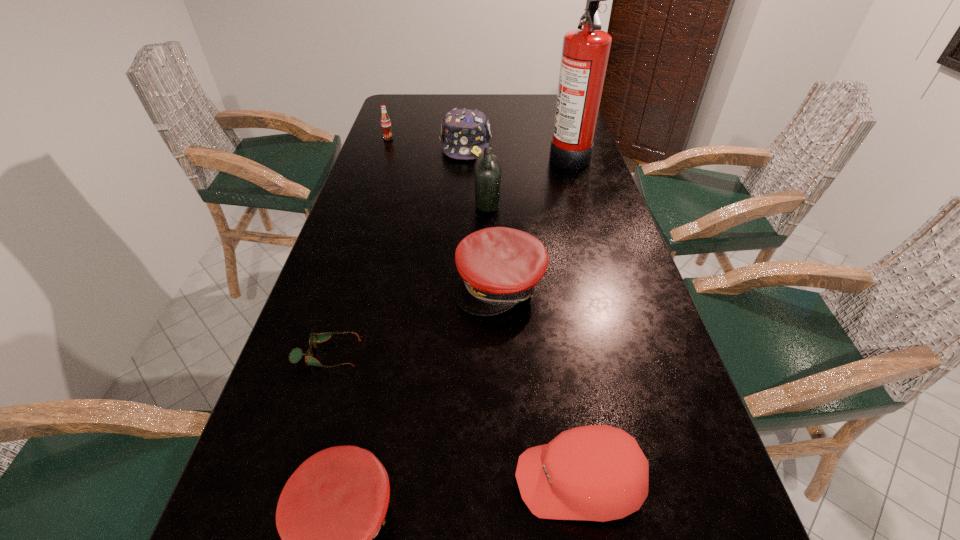
This screenshot has height=540, width=960. I want to click on the tallest object, so click(585, 52).

The width and height of the screenshot is (960, 540). Find the location of `the seventh shortest object`. the seventh shortest object is located at coordinates (487, 170).

Locate an element on the screen. The height and width of the screenshot is (540, 960). the fourth farthest object is located at coordinates (487, 170).

I want to click on soda, so click(x=385, y=121).

You are a GUI agent. You are given a task and a screenshot of the screen. Output one action in this format:
    pyautogui.click(x=<x>, y=<y>)
    Task: Click on the farthest cap
    This screenshot has height=540, width=960.
    Given the screenshot: What is the action you would take?
    pyautogui.click(x=465, y=133)

You are a GUI agent. You are given a task and a screenshot of the screen. Output one action in this format:
    pyautogui.click(x=<x>, y=<y>)
    Task: Click on the fourth nearest object
    
    Given the screenshot: What is the action you would take?
    pyautogui.click(x=499, y=267)

Where is `the third nearest object`? The image size is (960, 540). the third nearest object is located at coordinates (295, 356).

You are a GUI agent. You are given a task and a screenshot of the screen. Output one action in this format:
    pyautogui.click(x=<x>, y=<y>)
    Task: Click on the spectacles
    
    Given the screenshot: What is the action you would take?
    pyautogui.click(x=295, y=356)

This screenshot has height=540, width=960. In order to click on free spot located 0.200m on the front-facing side of the tallest object in this screenshot , I will do `click(489, 156)`.

Where is `vacant space located on the front-facing side of the tallest object`? Image resolution: width=960 pixels, height=540 pixels. vacant space located on the front-facing side of the tallest object is located at coordinates (518, 156).